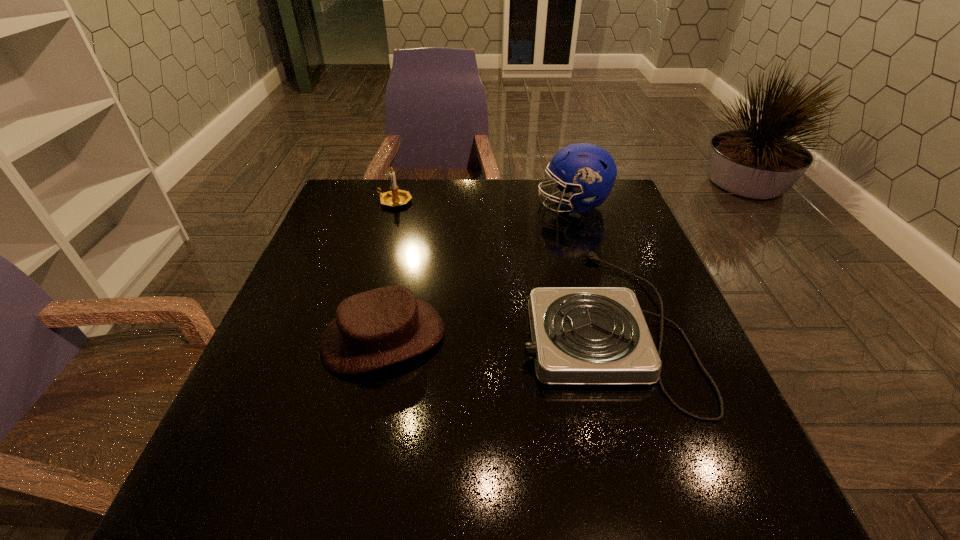
Where is `vacant area situated with a retractable cable on the side of the hotplate`? vacant area situated with a retractable cable on the side of the hotplate is located at coordinates (444, 324).

Locate an element on the screen. Image resolution: width=960 pixels, height=540 pixels. vacant area situated 0.330m with a retractable cable on the side of the hotplate is located at coordinates (364, 324).

Where is `football helmet that is at the far edge`? The image size is (960, 540). football helmet that is at the far edge is located at coordinates (590, 171).

Identify the location of candle holder at the far edge. (395, 197).

Locate an element on the screen. candle holder located in the left edge section of the desktop is located at coordinates (395, 197).

You are a GUI agent. You are given a task and a screenshot of the screen. Output one action in this format:
    pyautogui.click(x=<x>, y=<y>)
    Task: Click on the hat located at the left edge
    
    Given the screenshot: What is the action you would take?
    pyautogui.click(x=380, y=327)

You are a GUI agent. You are given a task and a screenshot of the screen. Output one action in this format:
    pyautogui.click(x=<x>, y=<y>)
    Task: Click on the football helmet located at the right edge
    The image size is (960, 540).
    Given the screenshot: What is the action you would take?
    pyautogui.click(x=590, y=171)

You are a GUI agent. You are given a task and a screenshot of the screen. Output one action in this format:
    pyautogui.click(x=<x>, y=<y>)
    Task: Click on the hotplate that is at the right edge
    
    Given the screenshot: What is the action you would take?
    pyautogui.click(x=580, y=335)

At what (x,y) coordinates should I click in order to perform the action: click on object located in the far left corner section of the desktop. Please return your answer as a coordinate pair (x, y). The image size is (960, 540). Looking at the image, I should click on (395, 197).

What are the coordinates of `object that is at the far right corner` in the screenshot? It's located at (590, 171).